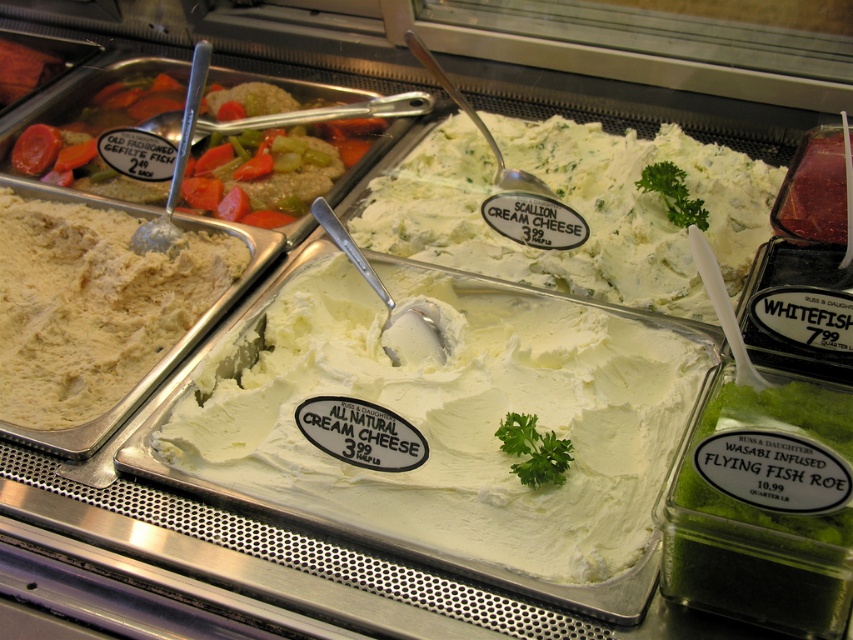
Between white creamy spread at center and old fashioned gefilte fish at upper left, which one is positioned lower?

white creamy spread at center

Is white creamy spread at center taller than old fashioned gefilte fish at upper left?

Yes.

Which is in front, point (524, 168) or point (354, 161)?

Point (524, 168)

This screenshot has width=853, height=640. What are the coordinates of `white creamy spread at center` in the screenshot? It's located at (575, 209).

Is point (625, 396) behind point (651, 305)?

No, it is not.

Looking at this image, does white creamy cream cheese at center have a greater height compared to white creamy spread at center?

No, white creamy cream cheese at center is not taller than white creamy spread at center.

This screenshot has width=853, height=640. Identify the location of white creamy cream cheese at center. (451, 419).

Which is behind, point (306, 340) or point (16, 160)?

Point (16, 160)

Who is more distant from viewer, [213,365] or [305,208]?

The point [305,208] is more distant.

Where is `white creamy cream cheese at center`? The image size is (853, 640). white creamy cream cheese at center is located at coordinates (451, 419).